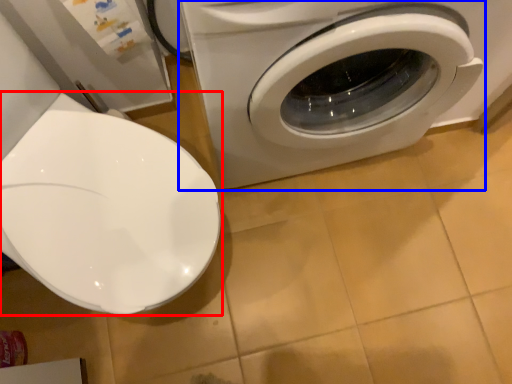
Question: Which object is closer to the camera taking this photo, toilet (highlighted by a red box) or washing machine (highlighted by a blue box)?

Choices:
 (A) toilet
 (B) washing machine

Answer: (A)